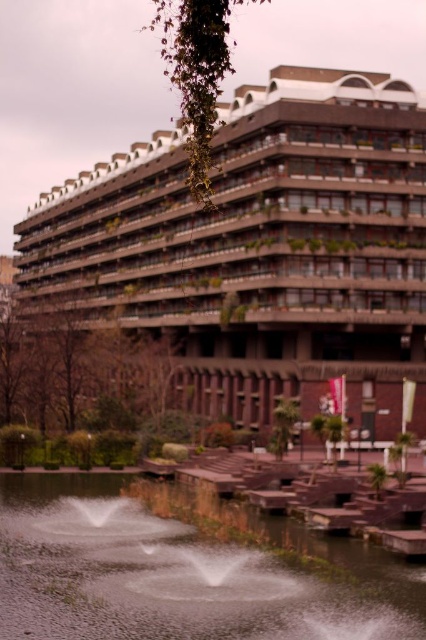
Question: Does brown concrete building at center appear on the right side of clear water at center?

Choices:
 (A) no
 (B) yes

Answer: (A)

Question: Which point is closer to the camera?

Choices:
 (A) (256, 636)
 (B) (368, 372)

Answer: (A)

Question: Among these objects, which one is farthest from the camera?

Choices:
 (A) clear water at center
 (B) brown concrete building at center

Answer: (B)

Question: Can you confirm if brown concrete building at center is thinner than clear water at center?

Choices:
 (A) no
 (B) yes

Answer: (A)

Question: Among these objects, which one is nearest to the camera?

Choices:
 (A) brown concrete building at center
 (B) clear water at center

Answer: (B)

Question: Where is brown concrete building at center located in relation to clear water at center in the image?

Choices:
 (A) right
 (B) left

Answer: (B)